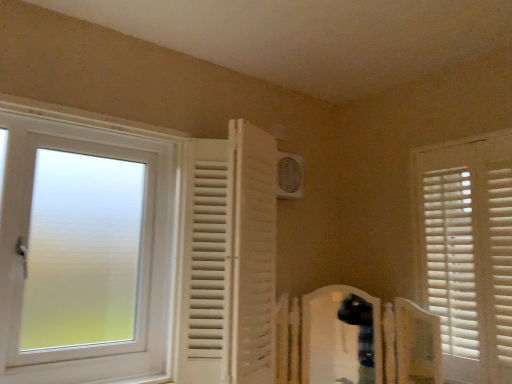
Question: In which direction should I rotate to look at white plastic air conditioning unit at upper center?

Choices:
 (A) right
 (B) left

Answer: (A)

Question: Does white wooden blinds at right, which is the first window from right to left, have a smaller size compared to white plastic air conditioning unit at upper center?

Choices:
 (A) no
 (B) yes

Answer: (A)

Question: Is white wooden blinds at right, which ranks as the second window in left-to-right order, far away from white plastic air conditioning unit at upper center?

Choices:
 (A) yes
 (B) no

Answer: (B)

Question: Is the position of white wooden blinds at right, which is the first window from right to left, less distant than that of white plastic air conditioning unit at upper center?

Choices:
 (A) yes
 (B) no

Answer: (A)

Question: Could you tell me if white wooden blinds at right, which ranks as the second window in left-to-right order, is turned towards white plastic air conditioning unit at upper center?

Choices:
 (A) no
 (B) yes

Answer: (A)

Question: From the image's perspective, is white wooden blinds at right, which ranks as the second window in left-to-right order, under white plastic air conditioning unit at upper center?

Choices:
 (A) yes
 (B) no

Answer: (A)

Question: Is white wooden blinds at right, which is the first window from right to left, to the right of white plastic air conditioning unit at upper center from the viewer's perspective?

Choices:
 (A) yes
 (B) no

Answer: (A)

Question: From the image's perspective, is white frosted glass window at left, the 1th window from the left, beneath white wooden blinds at right, which ranks as the second window in left-to-right order?

Choices:
 (A) yes
 (B) no

Answer: (B)

Question: Is white frosted glass window at left, the 1th window from the left, oriented away from white wooden blinds at right, which ranks as the second window in left-to-right order?

Choices:
 (A) no
 (B) yes

Answer: (A)

Question: Is white frosted glass window at left, the 1th window from the left, further to the viewer compared to white wooden blinds at right, which is the first window from right to left?

Choices:
 (A) no
 (B) yes

Answer: (A)

Question: Is white frosted glass window at left, which is the second window in right-to-left order, bigger than white wooden blinds at right, which ranks as the second window in left-to-right order?

Choices:
 (A) yes
 (B) no

Answer: (A)

Question: Are white frosted glass window at left, which is the second window in right-to-left order, and white wooden blinds at right, which ranks as the second window in left-to-right order, beside each other?

Choices:
 (A) no
 (B) yes

Answer: (A)

Question: Considering the relative sizes of white frosted glass window at left, which is the second window in right-to-left order, and white wooden blinds at right, which is the first window from right to left, in the image provided, is white frosted glass window at left, which is the second window in right-to-left order, wider than white wooden blinds at right, which is the first window from right to left,?

Choices:
 (A) no
 (B) yes

Answer: (B)

Question: Can you confirm if white frosted glass window at left, which is the second window in right-to-left order, is smaller than white plastic air conditioning unit at upper center?

Choices:
 (A) no
 (B) yes

Answer: (A)